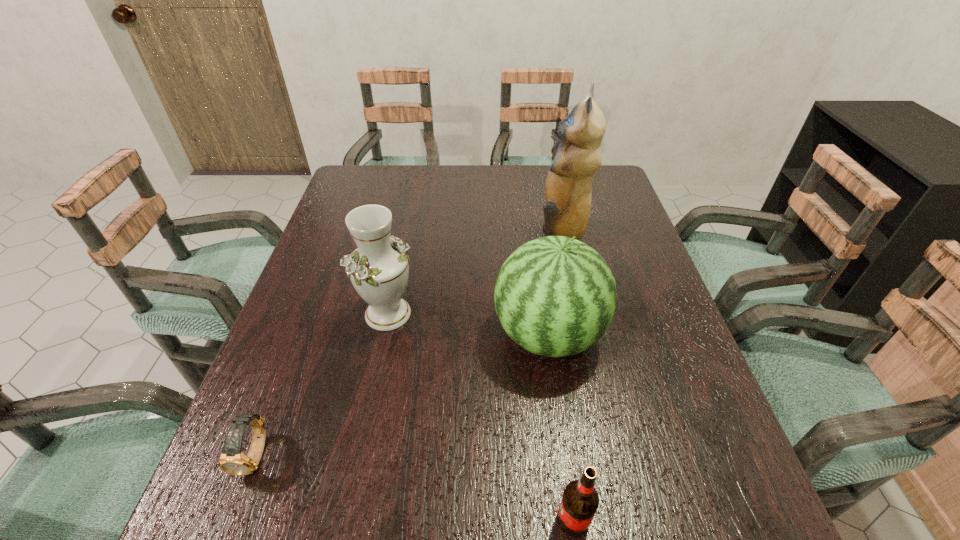
This screenshot has height=540, width=960. I want to click on empty space between the watermelon and the leftmost object, so click(402, 395).

Find the location of a particular element. This screenshot has height=540, width=960. empty space between the vase and the farthest object is located at coordinates (473, 274).

You are a GUI agent. You are given a task and a screenshot of the screen. Output one action in this format:
    pyautogui.click(x=<x>, y=<y>)
    Task: Click on the third closest object to the watch
    The width and height of the screenshot is (960, 540).
    Given the screenshot: What is the action you would take?
    pyautogui.click(x=580, y=501)

Identify which object is the second closest to the watermelon. Please provide its 2D coordinates. Your answer should be formatted as a tuple, i.e. [(x, y)], where the tuple contains the x and y coordinates of a point satisfying the conditions above.

[(568, 190)]

I want to click on blank space that satisfies the following two spatial constraints: 1. on the face of the leftmost object; 2. on the right side of the nearest object, so click(232, 519).

The image size is (960, 540). I want to click on free location that satisfies the following two spatial constraints: 1. on the face of the shortest object; 2. on the left side of the nearest object, so click(x=232, y=519).

At what (x,y) coordinates should I click in order to perform the action: click on vacant region that satisfies the following two spatial constraints: 1. on the face of the cat; 2. on the face of the shortest object. Please return your answer as a coordinate pair (x, y). Looking at the image, I should click on (607, 454).